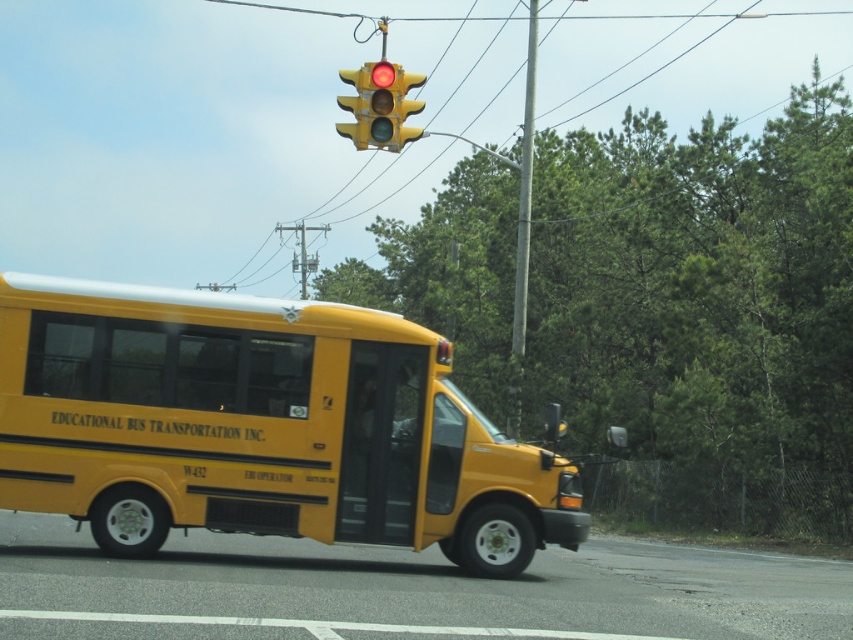
Is yellow matte bus at center smaller than yellow matte traffic light at upper center?

Correct, yellow matte bus at center occupies less space than yellow matte traffic light at upper center.

Can you confirm if yellow matte bus at center is positioned to the left of yellow matte traffic light at upper center?

No, yellow matte bus at center is not to the left of yellow matte traffic light at upper center.

Does point (473, 554) lie in front of point (386, 99)?

Yes, it is.

Find the location of a particular element. This screenshot has height=640, width=853. yellow matte bus at center is located at coordinates (259, 426).

Can you confirm if yellow matte bus at center is positioned to the left of metallic gray pole at center?

Yes, yellow matte bus at center is to the left of metallic gray pole at center.

Between yellow matte bus at center and metallic gray pole at center, which one has less height?

With less height is yellow matte bus at center.

Which is behind, point (50, 404) or point (524, 268)?

Positioned behind is point (524, 268).

What are the coordinates of `yellow matte bus at center` in the screenshot? It's located at (259, 426).

Can you confirm if yellow matte traffic light at upper center is thinner than metallic gray pole at center?

Yes.

Measure the distance from yellow matte traffic light at upper center to metallic gray pole at center.

yellow matte traffic light at upper center and metallic gray pole at center are 20.72 meters apart from each other.

This screenshot has width=853, height=640. What do you see at coordinates (379, 106) in the screenshot? I see `yellow matte traffic light at upper center` at bounding box center [379, 106].

The image size is (853, 640). What are the coordinates of `yellow matte traffic light at upper center` in the screenshot? It's located at pos(379,106).